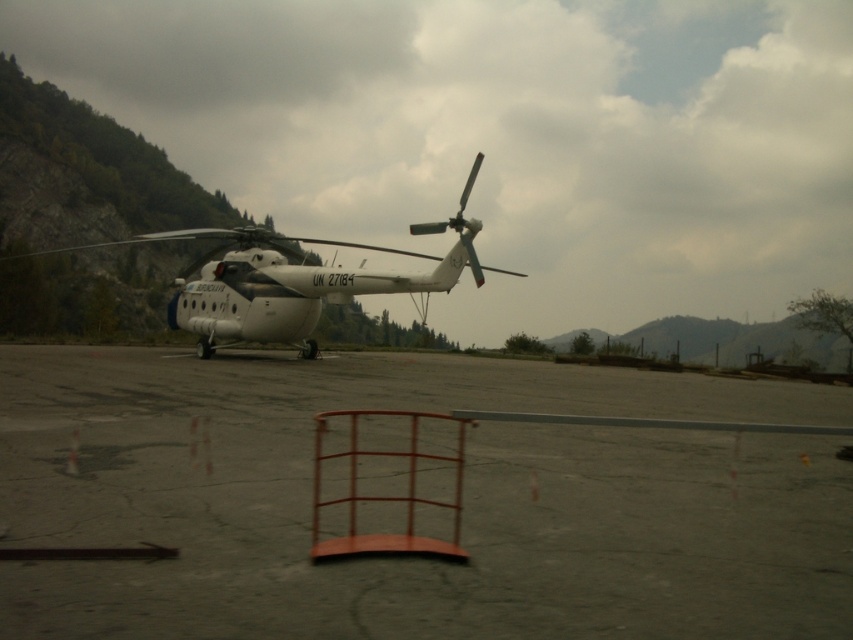
Looking at this image, is gray concrete tarmac at center shorter than white matte helicopter at center?

Yes.

Is gray concrete tarmac at center to the right of white matte helicopter at center from the viewer's perspective?

Yes, gray concrete tarmac at center is to the right of white matte helicopter at center.

Identify the location of gray concrete tarmac at center. This screenshot has width=853, height=640. (463, 500).